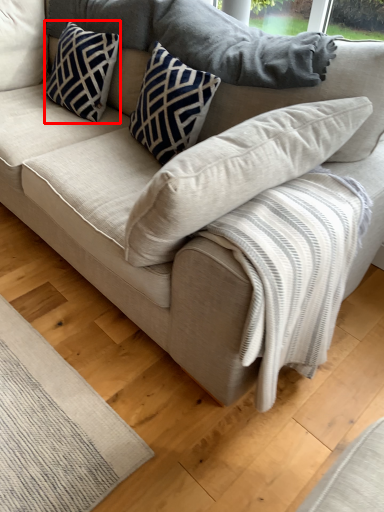
Question: Considering the relative positions of pillow (annotated by the red box) and pillow in the image provided, where is pillow (annotated by the red box) located with respect to the staircase?

Choices:
 (A) right
 (B) left

Answer: (B)